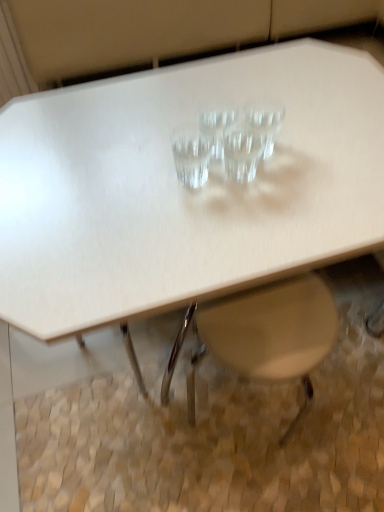
Locate an element on the screen. This screenshot has width=384, height=512. free spot in front of transparent glass martini glass at center, acting as the 4th martini glass starting from the left is located at coordinates (264, 212).